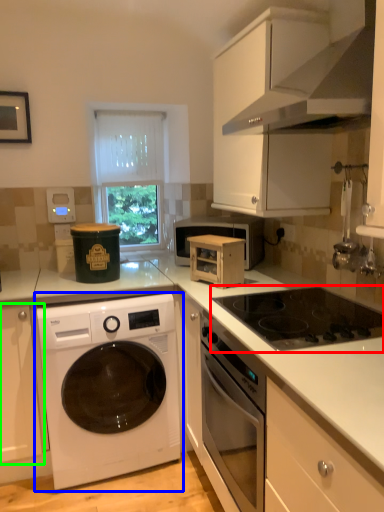
Question: Estimate the real-world distances between objects in this image. Which object is farther from gas stove (highlighted by a red box), washing machine (highlighted by a blue box) or cabinetry (highlighted by a green box)?

Choices:
 (A) washing machine
 (B) cabinetry

Answer: (B)